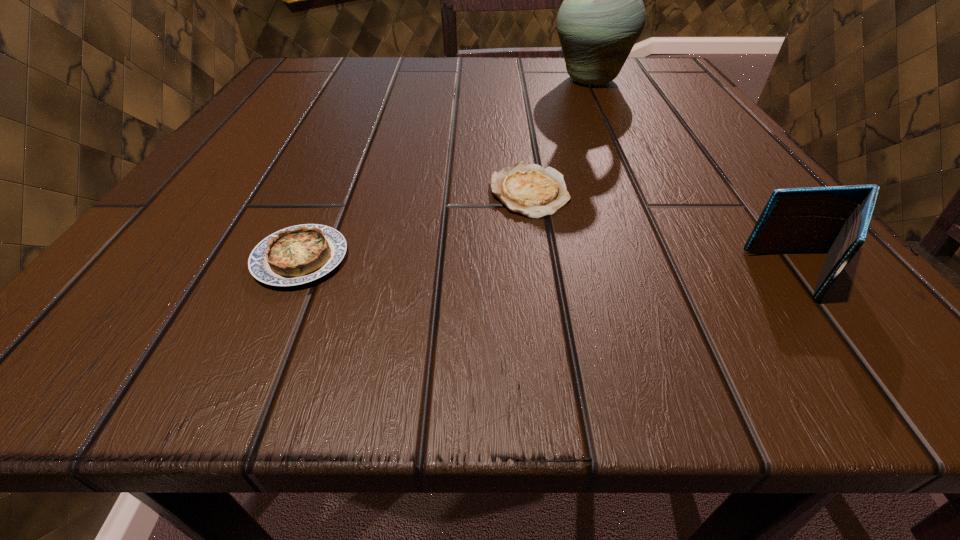
Where is `free space located 0.250m on the exterior surface of the wallet`? This screenshot has height=540, width=960. free space located 0.250m on the exterior surface of the wallet is located at coordinates (508, 275).

The height and width of the screenshot is (540, 960). What are the coordinates of `vacant space situated 0.390m on the exterior surface of the wallet` in the screenshot? It's located at (369, 275).

Locate an element on the screen. free point located 0.070m on the back of the left quiche is located at coordinates (328, 195).

Where is `vacant space situated 0.330m on the back of the second farthest object`? The height and width of the screenshot is (540, 960). vacant space situated 0.330m on the back of the second farthest object is located at coordinates (513, 78).

This screenshot has height=540, width=960. Find the location of `object positioned at the far edge`. object positioned at the far edge is located at coordinates (602, 16).

At what (x,y) coordinates should I click in order to perform the action: click on wallet at the near edge. Please return your answer as a coordinate pair (x, y). Looking at the image, I should click on (835, 220).

Locate an element on the screen. quiche that is at the near edge is located at coordinates pos(300,254).

Where is `object that is positioned at the left edge`? This screenshot has height=540, width=960. object that is positioned at the left edge is located at coordinates (300, 254).

Where is `pitcher that is at the right edge`? Image resolution: width=960 pixels, height=540 pixels. pitcher that is at the right edge is located at coordinates (602, 16).

Locate an element on the screen. wallet located in the right edge section of the desktop is located at coordinates (835, 220).